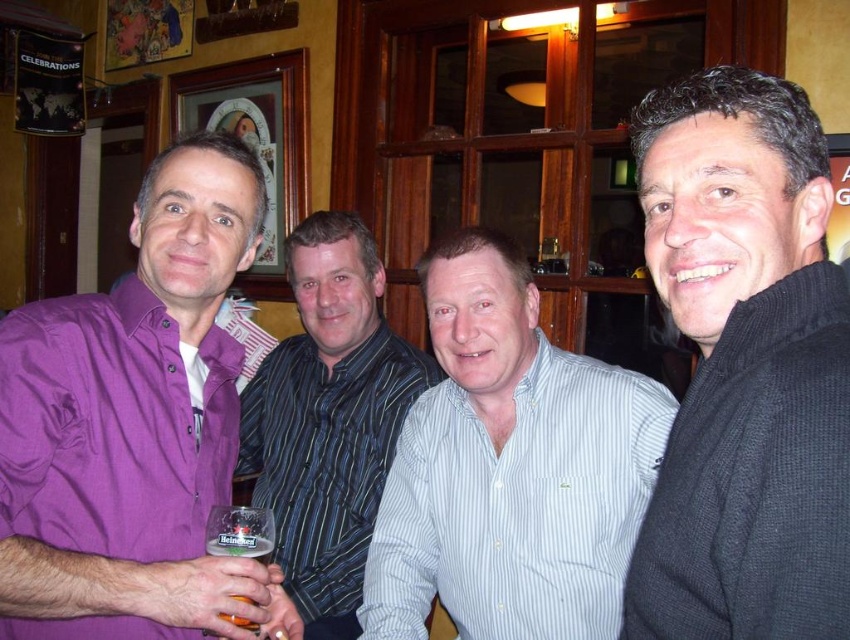
Is black wool sweater at right taller than translucent plastic beer glass at lower left?

Indeed, black wool sweater at right has a greater height compared to translucent plastic beer glass at lower left.

Is black wool sweater at right thinner than translucent plastic beer glass at lower left?

Incorrect, black wool sweater at right's width is not less than translucent plastic beer glass at lower left's.

This screenshot has height=640, width=850. In order to click on black wool sweater at right in this screenshot , I will do `click(744, 369)`.

Between purple cotton shirt at left and light blue striped shirt at center, which one has more height?

With more height is light blue striped shirt at center.

Does purple cotton shirt at left have a larger size compared to light blue striped shirt at center?

No, purple cotton shirt at left is not bigger than light blue striped shirt at center.

Locate an element on the screen. Image resolution: width=850 pixels, height=640 pixels. purple cotton shirt at left is located at coordinates (134, 426).

Is the position of light blue striped shirt at center less distant than that of striped shirt at center?

That is True.

Who is taller, light blue striped shirt at center or striped shirt at center?

striped shirt at center is taller.

Is point (554, 451) closer to viewer compared to point (344, 282)?

Yes, point (554, 451) is in front of point (344, 282).

The image size is (850, 640). I want to click on light blue striped shirt at center, so click(x=510, y=467).